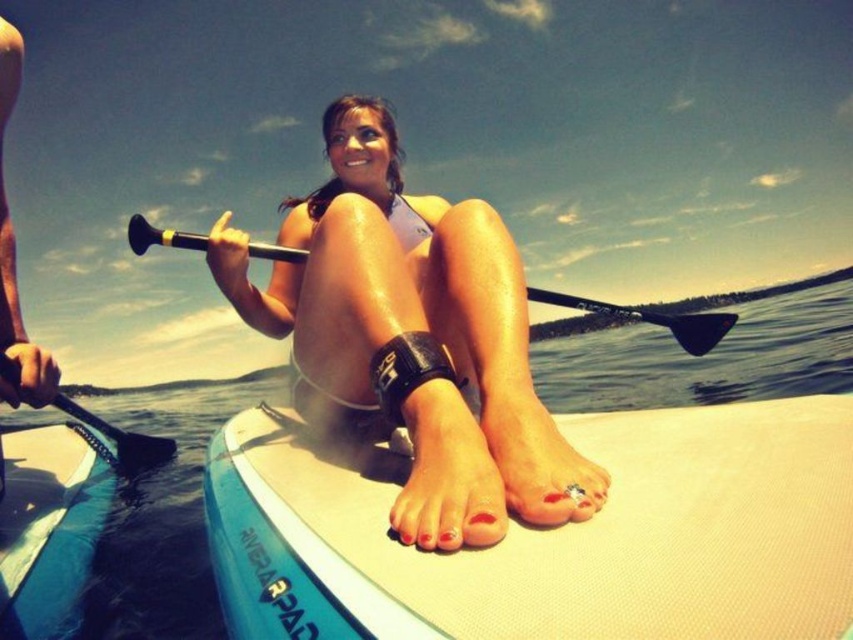
Can you confirm if black rubber paddle at center is bigger than black rubber paddle at left?

No.

How far apart are black rubber paddle at center and black rubber paddle at left?

black rubber paddle at center and black rubber paddle at left are 10.89 feet apart.

Where is `black rubber paddle at center`? The width and height of the screenshot is (853, 640). black rubber paddle at center is located at coordinates (650, 317).

Can you confirm if white textured surfboard at center is bigger than matte white surfboard at center?

No, white textured surfboard at center is not bigger than matte white surfboard at center.

Does white textured surfboard at center have a lesser width compared to matte white surfboard at center?

No, white textured surfboard at center is not thinner than matte white surfboard at center.

Which is behind, point (848, 488) or point (316, 234)?

Positioned behind is point (316, 234).

Image resolution: width=853 pixels, height=640 pixels. Find the location of `white textured surfboard at center`. white textured surfboard at center is located at coordinates (550, 536).

Describe the element at coordinates (550, 536) in the screenshot. I see `white textured surfboard at center` at that location.

Is white textured surfboard at center to the right of black rubber paddle at left from the viewer's perspective?

Yes, white textured surfboard at center is to the right of black rubber paddle at left.

The image size is (853, 640). Identify the location of white textured surfboard at center. (550, 536).